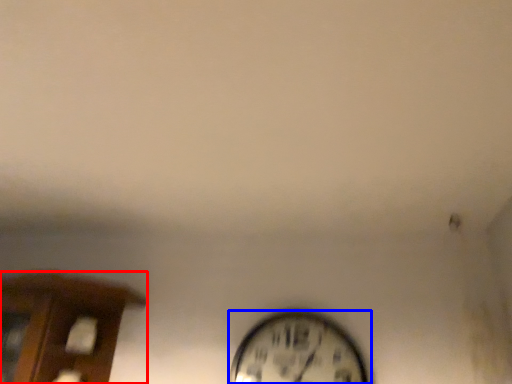
Question: Which object appears closest to the camera in this image, furniture (highlighted by a red box) or wall clock (highlighted by a blue box)?

Choices:
 (A) furniture
 (B) wall clock

Answer: (A)